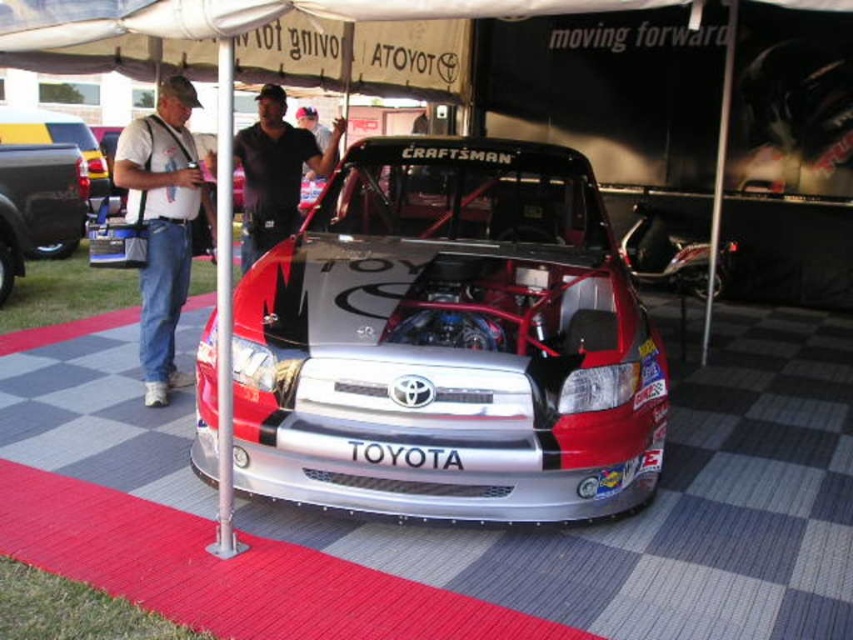
Question: Which object appears closest to the camera in this image?

Choices:
 (A) black glossy truck at left
 (B) matte black truck at left
 (C) white cotton t-shirt at left

Answer: (C)

Question: From the image, what is the correct spatial relationship of matte black truck at left in relation to black glossy truck at left?

Choices:
 (A) above
 (B) below

Answer: (B)

Question: Can you confirm if white cotton t-shirt at left is positioned above matte black truck at left?

Choices:
 (A) yes
 (B) no

Answer: (B)

Question: Can you confirm if shiny metallic race car at center is wider than black glossy truck at left?

Choices:
 (A) no
 (B) yes

Answer: (B)

Question: Which object appears closest to the camera in this image?

Choices:
 (A) black glossy truck at left
 (B) matte black truck at left

Answer: (B)

Question: Which point appears farthest from the camera in this image?

Choices:
 (A) (39, 195)
 (B) (190, 148)

Answer: (A)